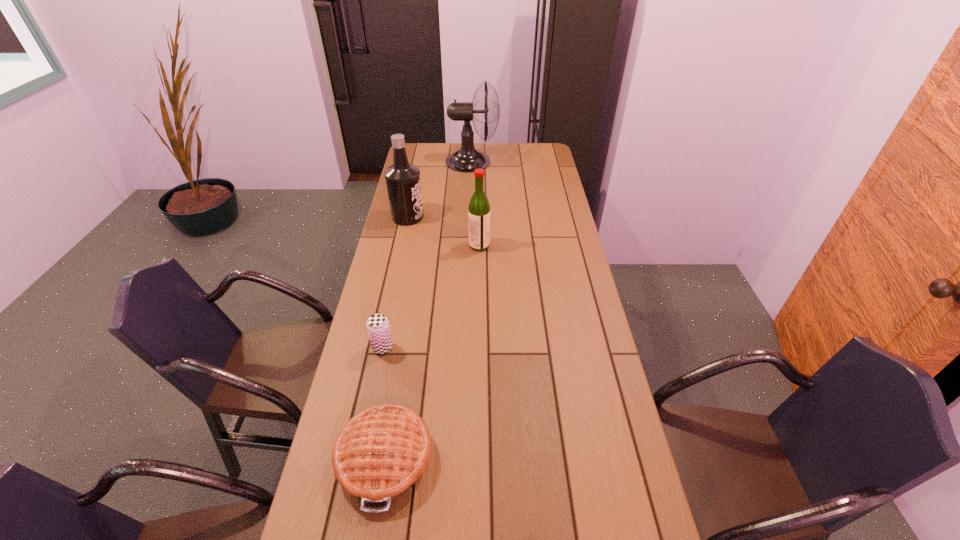
The width and height of the screenshot is (960, 540). What are the coordinates of `vacant region that satisfies the following two spatial constraints: 1. on the front label of the left liquor; 2. on the right side of the pie` in the screenshot? It's located at (356, 458).